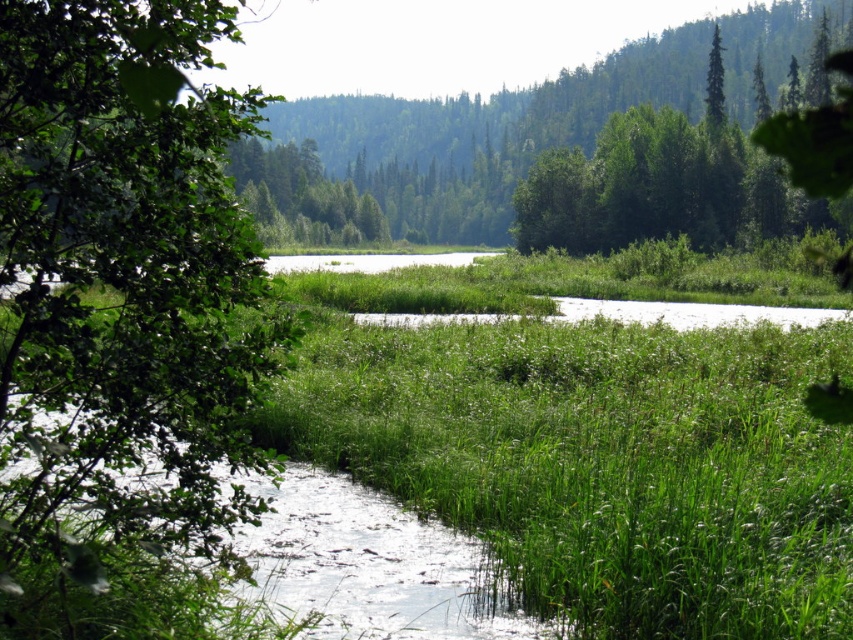
Question: Among these objects, which one is farthest from the camera?

Choices:
 (A) green leafy tree at left
 (B) green leafy tree at upper right
 (C) green grass at center

Answer: (B)

Question: Is green grass at center thinner than green leafy tree at left?

Choices:
 (A) no
 (B) yes

Answer: (B)

Question: Which object is closer to the camera taking this photo?

Choices:
 (A) green leafy tree at left
 (B) green grass at center

Answer: (A)

Question: Does green grass at center have a larger size compared to green leafy tree at upper right?

Choices:
 (A) yes
 (B) no

Answer: (B)

Question: Observing the image, what is the correct spatial positioning of green grass at center in reference to green leafy tree at left?

Choices:
 (A) below
 (B) above

Answer: (A)

Question: Which point appears farthest from the camera in this image?

Choices:
 (A) (711, 88)
 (B) (338, 364)

Answer: (A)